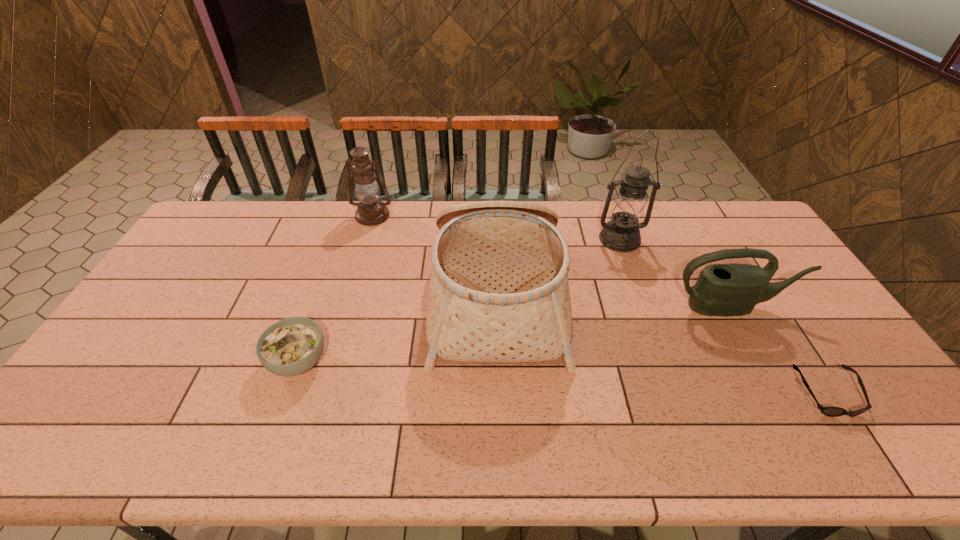
Choose which object is the second nearest neighbor to the farther oil lamp. Please provide its 2D coordinates. Your answer should be formatted as a tuple, i.e. [(x, y)], where the tuple contains the x and y coordinates of a point satisfying the conditions above.

[(292, 346)]